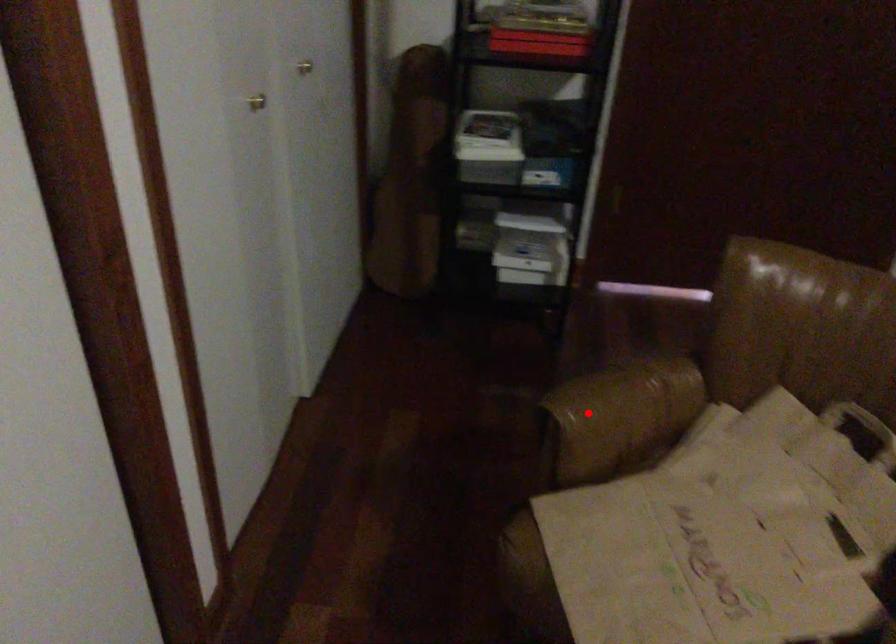
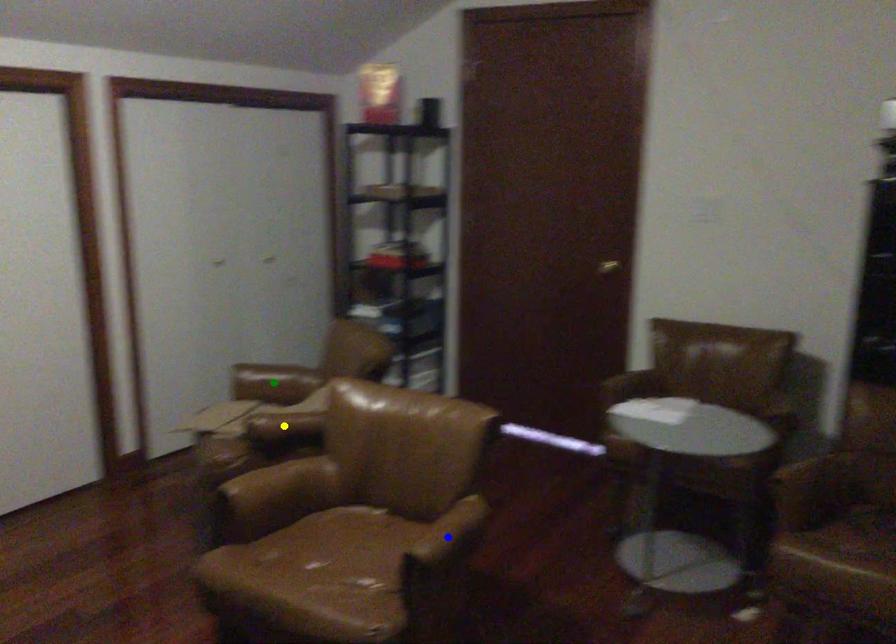
Question: I am providing you with two images of the same scene from different viewpoints. A red point is marked on the first image. You are given multiple points on the second image. Which spot in image 2 lines up with the point in image 1?

Choices:
 (A) green point
 (B) blue point
 (C) yellow point

Answer: (A)